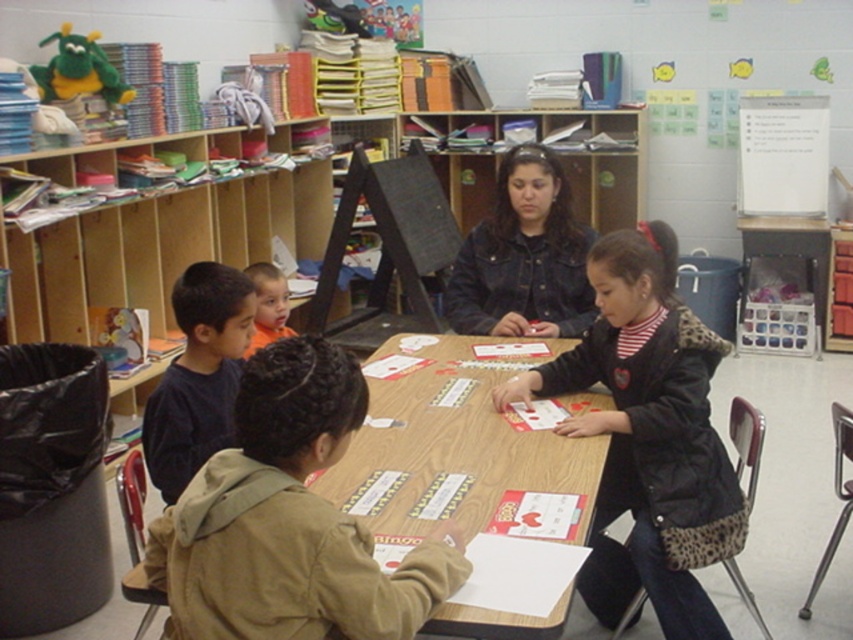
Question: Does wooden table at center have a smaller size compared to dark blue shirt at left?

Choices:
 (A) yes
 (B) no

Answer: (B)

Question: Which of these objects is positioned farthest from the khaki fleece jacket at center?

Choices:
 (A) orange shirt at left
 (B) wooden table at center
 (C) denim jacket at center

Answer: (C)

Question: In this image, where is wooden table at center located relative to denim jacket at center?

Choices:
 (A) below
 (B) above

Answer: (A)

Question: Which point is closer to the camera taking this photo?

Choices:
 (A) (260, 326)
 (B) (254, 592)

Answer: (B)

Question: Which object is farther from the camera taking this photo?

Choices:
 (A) denim jacket at center
 (B) khaki fleece jacket at center
 (C) orange shirt at left
 (D) wooden table at center

Answer: (A)

Question: Does khaki fleece jacket at center appear on the right side of dark blue shirt at left?

Choices:
 (A) yes
 (B) no

Answer: (A)